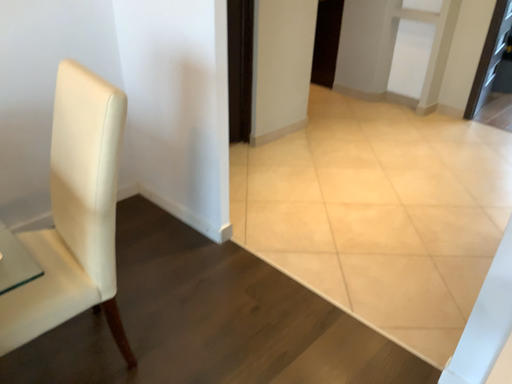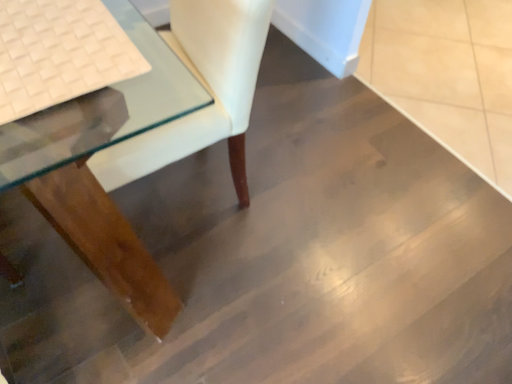
Question: Which way did the camera rotate in the video?

Choices:
 (A) rotated right
 (B) rotated left

Answer: (B)